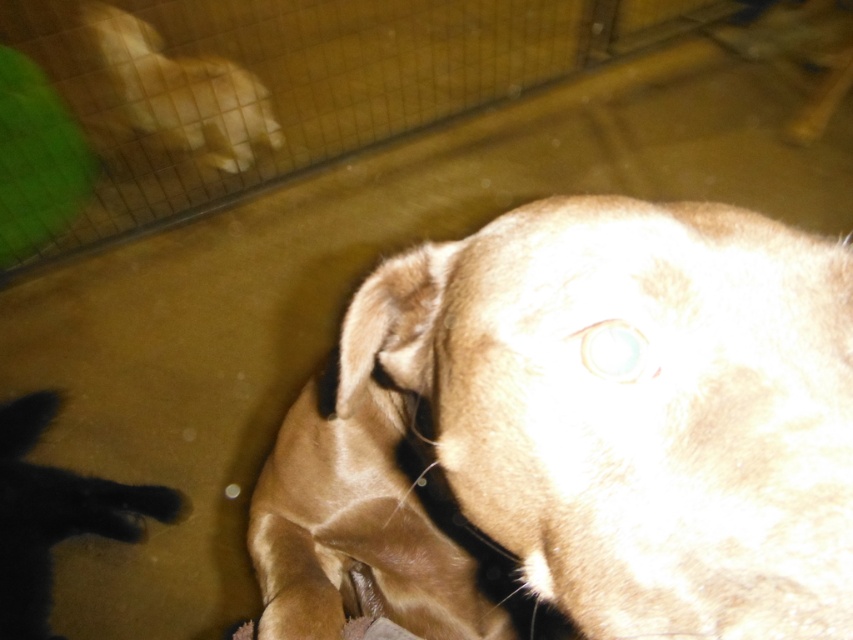
Question: From the image, what is the correct spatial relationship of fuzzy brown dog at center in relation to fuzzy beige dog at upper left?

Choices:
 (A) above
 (B) below

Answer: (B)

Question: Which point is farther from the camera taking this photo?

Choices:
 (A) (219, 76)
 (B) (746, 272)

Answer: (A)

Question: Where is fuzzy brown dog at center located in relation to fuzzy beige dog at upper left in the image?

Choices:
 (A) right
 (B) left

Answer: (A)

Question: Which point is farther from the camera taking this photo?

Choices:
 (A) (431, 548)
 (B) (155, 33)

Answer: (B)

Question: Can you confirm if fuzzy brown dog at center is wider than fuzzy beige dog at upper left?

Choices:
 (A) yes
 (B) no

Answer: (B)